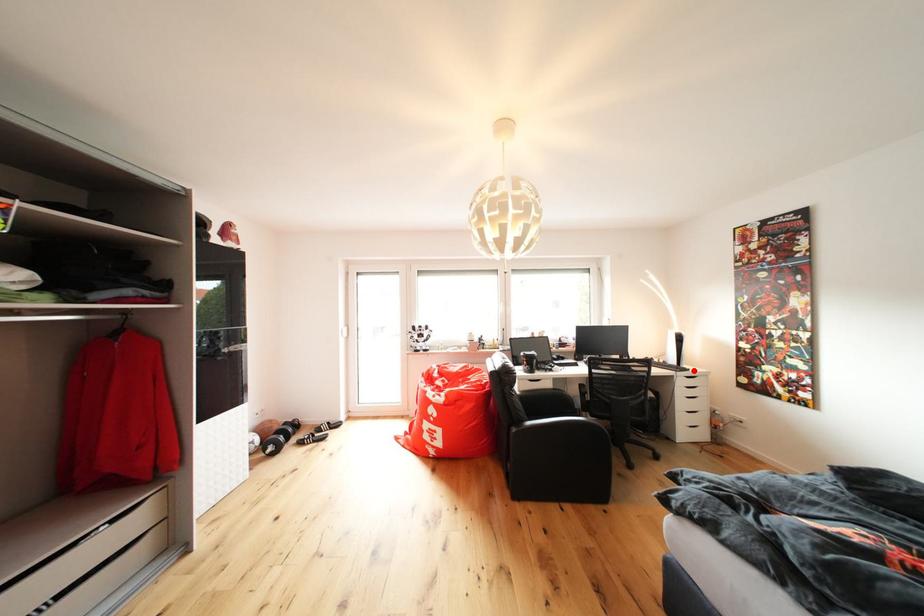
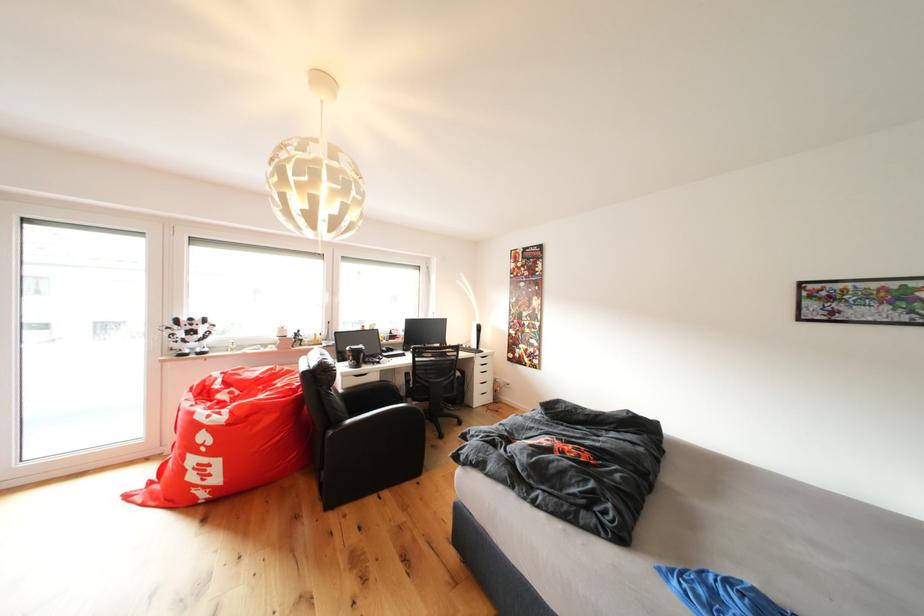
Find the pixel in the second image that matches the highlighted location in the first image.

(490, 354)